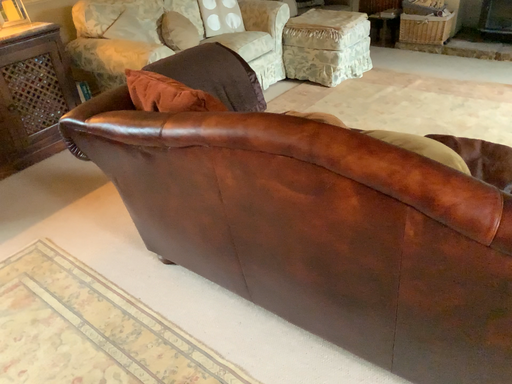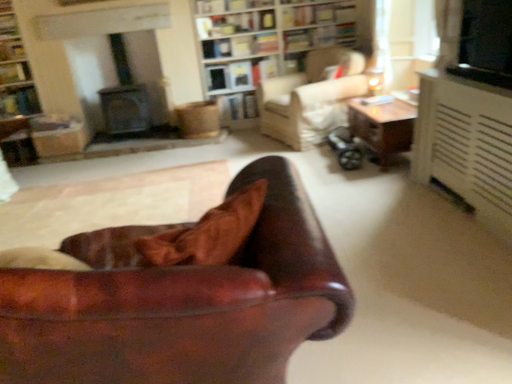
Question: Which way did the camera rotate in the video?

Choices:
 (A) rotated right
 (B) rotated left

Answer: (A)